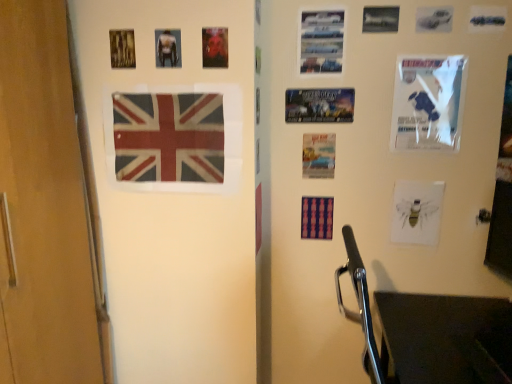
Question: Does matte plastic poster at upper center, the 9th poster page positioned from the right, have a larger size compared to matte plastic flag at center, the first flag positioned from the bottom?

Choices:
 (A) yes
 (B) no

Answer: (B)

Question: Can you confirm if matte plastic poster at upper center, marked as the third poster page in a left-to-right arrangement, is thinner than matte plastic flag at center, which ranks as the second flag in front-to-back order?

Choices:
 (A) no
 (B) yes

Answer: (A)

Question: Does matte plastic poster at upper center, the 9th poster page positioned from the right, come behind matte plastic flag at center, which ranks as the second flag in front-to-back order?

Choices:
 (A) no
 (B) yes

Answer: (A)

Question: Is there a large distance between matte plastic poster at upper center, the 9th poster page positioned from the right, and matte plastic flag at center, which is counted as the first flag, starting from the back?

Choices:
 (A) yes
 (B) no

Answer: (B)

Question: From a real-world perspective, is matte plastic poster at upper center, the 9th poster page positioned from the right, on top of matte plastic flag at center, which ranks as the second flag in front-to-back order?

Choices:
 (A) yes
 (B) no

Answer: (A)

Question: Is matte plastic poster at upper center, marked as the third poster page in a left-to-right arrangement, smaller than matte plastic flag at center, which is counted as the first flag, starting from the back?

Choices:
 (A) yes
 (B) no

Answer: (A)

Question: Does white glossy poster at upper right, the ninth poster page from the left, have a lesser height compared to metallic silver cars at upper right, which is the 5th poster page in left-to-right order?

Choices:
 (A) no
 (B) yes

Answer: (A)

Question: Is white glossy poster at upper right, the ninth poster page from the left, taller than metallic silver cars at upper right, which is the 7th poster page from right to left?

Choices:
 (A) yes
 (B) no

Answer: (A)

Question: Is white glossy poster at upper right, the ninth poster page from the left, directly adjacent to metallic silver cars at upper right, which is the 7th poster page from right to left?

Choices:
 (A) no
 (B) yes

Answer: (A)

Question: Considering the relative positions of white glossy poster at upper right, which ranks as the third poster page in right-to-left order, and metallic silver cars at upper right, which is the 5th poster page in left-to-right order, in the image provided, is white glossy poster at upper right, which ranks as the third poster page in right-to-left order, to the left of metallic silver cars at upper right, which is the 5th poster page in left-to-right order, from the viewer's perspective?

Choices:
 (A) no
 (B) yes

Answer: (A)

Question: Is white glossy poster at upper right, the ninth poster page from the left, thinner than metallic silver cars at upper right, which is the 5th poster page in left-to-right order?

Choices:
 (A) yes
 (B) no

Answer: (B)

Question: From a real-world perspective, is white glossy poster at upper right, the ninth poster page from the left, on metallic silver cars at upper right, which is the 7th poster page from right to left?

Choices:
 (A) no
 (B) yes

Answer: (A)

Question: From a real-world perspective, is metallic silver car at upper right, which ranks as the 1th poster page in right-to-left order, located beneath metallic silver cars at upper right, which is the 5th poster page in left-to-right order?

Choices:
 (A) yes
 (B) no

Answer: (B)